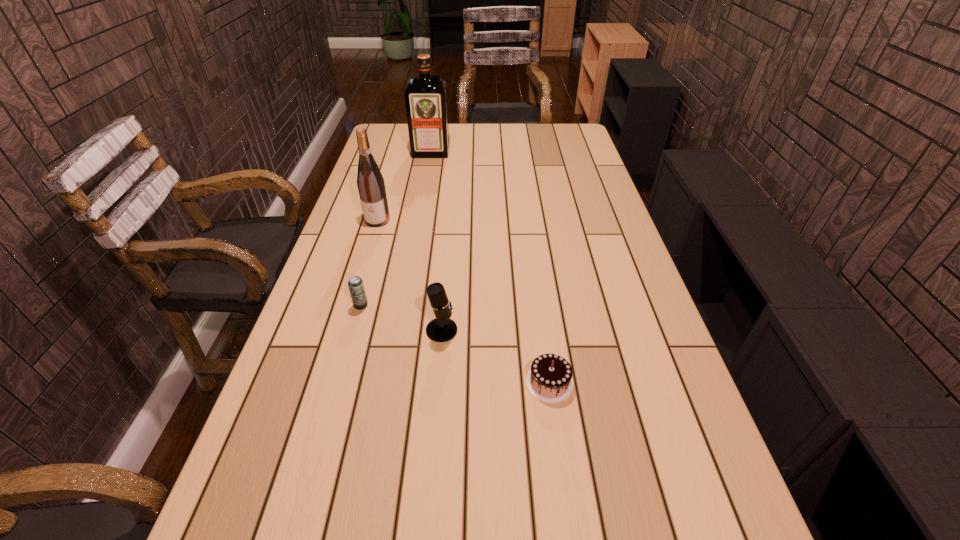
In the image, there is a desktop. At what (x,y) coordinates should I click in order to perform the action: click on vacant space at the far left corner. Please return your answer as a coordinate pair (x, y). Looking at the image, I should click on (407, 126).

The image size is (960, 540). Find the location of `vacant region between the nearest object and the third shortest object`. vacant region between the nearest object and the third shortest object is located at coordinates click(x=495, y=356).

Find the location of a particular element. Image resolution: width=960 pixels, height=540 pixels. vacant space in between the third nearest object and the tallest object is located at coordinates (396, 229).

The height and width of the screenshot is (540, 960). I want to click on vacant space in between the fourth shortest object and the fourth farthest object, so click(x=410, y=275).

Find the location of a particular element. This screenshot has height=540, width=960. free space between the beer can and the wine bottle is located at coordinates (370, 263).

Locate an element on the screen. The width and height of the screenshot is (960, 540). vacant point located between the third nearest object and the third tallest object is located at coordinates (401, 318).

Image resolution: width=960 pixels, height=540 pixels. Find the location of `empty space that is in between the fourth nearest object and the third shortest object`. empty space that is in between the fourth nearest object and the third shortest object is located at coordinates (410, 275).

You are a GUI agent. You are given a task and a screenshot of the screen. Output one action in this format:
    pyautogui.click(x=<x>, y=<y>)
    Task: Click on the unoccupied area between the fourth shortest object and the farthest object
    
    Given the screenshot: What is the action you would take?
    pyautogui.click(x=404, y=186)

You are a GUI agent. You are given a task and a screenshot of the screen. Output one action in this format:
    pyautogui.click(x=<x>, y=<y>)
    Task: Click on the free spot between the third shortest object and the tallest object
    
    Given the screenshot: What is the action you would take?
    pyautogui.click(x=436, y=241)

You are a GUI agent. You are given a task and a screenshot of the screen. Output one action in this format:
    pyautogui.click(x=<x>, y=<y>)
    Task: Click on the free space that is in between the beer can and the fourth nearest object
    The height and width of the screenshot is (540, 960).
    Given the screenshot: What is the action you would take?
    pyautogui.click(x=370, y=263)